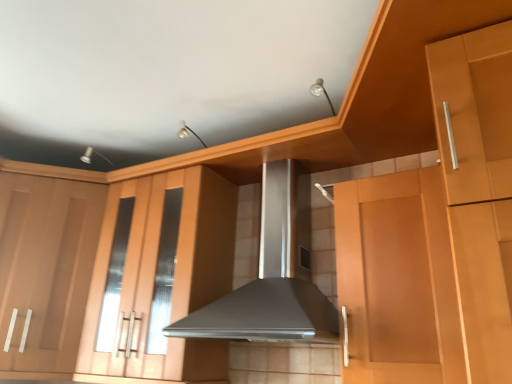
What do you see at coordinates (46, 268) in the screenshot? This screenshot has width=512, height=384. I see `matte wood cabinet at left, arranged as the second cabinetry when viewed from the right` at bounding box center [46, 268].

Describe the element at coordinates (273, 275) in the screenshot. I see `satin silver range hood at center` at that location.

Find the location of a particular element. matte wood cabinet at center, the second cabinetry positioned from the left is located at coordinates (174, 273).

From the image's perspective, is matte wood cabinet at left, positioned as the 1th cabinetry in left-to-right order, over satin silver range hood at center?

No, from the image's perspective, matte wood cabinet at left, positioned as the 1th cabinetry in left-to-right order, is not over satin silver range hood at center.

From a real-world perspective, is matte wood cabinet at left, positioned as the 1th cabinetry in left-to-right order, located beneath satin silver range hood at center?

Yes, from a real-world perspective, matte wood cabinet at left, positioned as the 1th cabinetry in left-to-right order, is beneath satin silver range hood at center.

Considering the sizes of objects matte wood cabinet at left, arranged as the second cabinetry when viewed from the right, and satin silver range hood at center in the image provided, who is wider, matte wood cabinet at left, arranged as the second cabinetry when viewed from the right, or satin silver range hood at center?

With larger width is matte wood cabinet at left, arranged as the second cabinetry when viewed from the right.

Is matte wood cabinet at left, arranged as the second cabinetry when viewed from the right, touching satin silver range hood at center?

No, matte wood cabinet at left, arranged as the second cabinetry when viewed from the right, is not touching satin silver range hood at center.

From the image's perspective, is matte wood cabinet at left, positioned as the 1th cabinetry in left-to-right order, located above or below matte wood cabinet at center, which is the first cabinetry in right-to-left order?

matte wood cabinet at left, positioned as the 1th cabinetry in left-to-right order, is below matte wood cabinet at center, which is the first cabinetry in right-to-left order.

Considering the relative sizes of matte wood cabinet at left, arranged as the second cabinetry when viewed from the right, and matte wood cabinet at center, which is the first cabinetry in right-to-left order, in the image provided, is matte wood cabinet at left, arranged as the second cabinetry when viewed from the right, bigger than matte wood cabinet at center, which is the first cabinetry in right-to-left order,?

Yes, matte wood cabinet at left, arranged as the second cabinetry when viewed from the right, is bigger than matte wood cabinet at center, which is the first cabinetry in right-to-left order.

Does matte wood cabinet at left, arranged as the second cabinetry when viewed from the right, touch matte wood cabinet at center, the second cabinetry positioned from the left?

No, matte wood cabinet at left, arranged as the second cabinetry when viewed from the right, is not in contact with matte wood cabinet at center, the second cabinetry positioned from the left.

From the picture: Considering the positions of objects matte wood cabinet at left, positioned as the 1th cabinetry in left-to-right order, and matte wood cabinet at center, which is the first cabinetry in right-to-left order, in the image provided, who is more to the left, matte wood cabinet at left, positioned as the 1th cabinetry in left-to-right order, or matte wood cabinet at center, which is the first cabinetry in right-to-left order,?

From the viewer's perspective, matte wood cabinet at left, positioned as the 1th cabinetry in left-to-right order, appears more on the left side.

How many degrees apart are the facing directions of satin silver range hood at center and matte wood cabinet at center, the second cabinetry positioned from the left?

They differ by 2.11 degrees in their facing directions.

Image resolution: width=512 pixels, height=384 pixels. What are the coordinates of `home appliance that is in front of the matte wood cabinet at center, which is the first cabinetry in right-to-left order` in the screenshot? It's located at (273, 275).

Which is behind, satin silver range hood at center or matte wood cabinet at center, the second cabinetry positioned from the left?

matte wood cabinet at center, the second cabinetry positioned from the left.

Which is less distant, (302,333) or (228,225)?

Point (302,333) appears to be closer to the viewer than point (228,225).

Is satin silver range hood at center closer to the viewer compared to matte wood cabinet at left, arranged as the second cabinetry when viewed from the right?

Yes, it is.

Is matte wood cabinet at left, positioned as the 1th cabinetry in left-to-right order, completely or partially inside satin silver range hood at center?

No.

How different are the orientations of satin silver range hood at center and matte wood cabinet at left, arranged as the second cabinetry when viewed from the right, in degrees?

They differ by 36.1 degrees in their facing directions.

Considering the relative sizes of satin silver range hood at center and matte wood cabinet at left, positioned as the 1th cabinetry in left-to-right order, in the image provided, is satin silver range hood at center thinner than matte wood cabinet at left, positioned as the 1th cabinetry in left-to-right order,?

Indeed, satin silver range hood at center has a lesser width compared to matte wood cabinet at left, positioned as the 1th cabinetry in left-to-right order.

Is matte wood cabinet at center, the second cabinetry positioned from the left, oriented away from matte wood cabinet at left, arranged as the second cabinetry when viewed from the right?

That's not correct — matte wood cabinet at center, the second cabinetry positioned from the left, is not looking away from matte wood cabinet at left, arranged as the second cabinetry when viewed from the right.

Which object is further away from the camera, matte wood cabinet at center, which is the first cabinetry in right-to-left order, or matte wood cabinet at left, positioned as the 1th cabinetry in left-to-right order?

matte wood cabinet at left, positioned as the 1th cabinetry in left-to-right order, is behind.

From the picture: Could you measure the distance between matte wood cabinet at center, which is the first cabinetry in right-to-left order, and matte wood cabinet at left, arranged as the second cabinetry when viewed from the right?

matte wood cabinet at center, which is the first cabinetry in right-to-left order, is 13.03 inches away from matte wood cabinet at left, arranged as the second cabinetry when viewed from the right.

Can you see matte wood cabinet at center, which is the first cabinetry in right-to-left order, touching satin silver range hood at center?

matte wood cabinet at center, which is the first cabinetry in right-to-left order, and satin silver range hood at center are clearly separated.

Is point (197, 196) behind point (307, 303)?

Yes, point (197, 196) is farther from viewer.

From the image's perspective, is matte wood cabinet at center, the second cabinetry positioned from the left, under satin silver range hood at center?

Yes, from the image's perspective, matte wood cabinet at center, the second cabinetry positioned from the left, is below satin silver range hood at center.

Consider the image. From a real-world perspective, is matte wood cabinet at center, which is the first cabinetry in right-to-left order, positioned above or below satin silver range hood at center?

Clearly, from a real-world perspective, matte wood cabinet at center, which is the first cabinetry in right-to-left order, is below satin silver range hood at center.

At what (x,y) coordinates should I click in order to perform the action: click on home appliance above the matte wood cabinet at left, positioned as the 1th cabinetry in left-to-right order (from a real-world perspective). Please return your answer as a coordinate pair (x, y). Looking at the image, I should click on (273, 275).

Where is `cabinetry to the left of matte wood cabinet at center, the second cabinetry positioned from the left`? The width and height of the screenshot is (512, 384). cabinetry to the left of matte wood cabinet at center, the second cabinetry positioned from the left is located at coordinates (46, 268).

Which object lies further to the anchor point satin silver range hood at center, matte wood cabinet at center, the second cabinetry positioned from the left, or matte wood cabinet at left, positioned as the 1th cabinetry in left-to-right order?

matte wood cabinet at left, positioned as the 1th cabinetry in left-to-right order, is positioned further to the anchor satin silver range hood at center.

Considering their positions, is matte wood cabinet at left, arranged as the second cabinetry when viewed from the right, positioned closer to satin silver range hood at center than matte wood cabinet at center, which is the first cabinetry in right-to-left order?

The object closer to satin silver range hood at center is matte wood cabinet at center, which is the first cabinetry in right-to-left order.

Estimate the real-world distances between objects in this image. Which object is closer to matte wood cabinet at left, positioned as the 1th cabinetry in left-to-right order, satin silver range hood at center or matte wood cabinet at center, the second cabinetry positioned from the left?

The object closer to matte wood cabinet at left, positioned as the 1th cabinetry in left-to-right order, is matte wood cabinet at center, the second cabinetry positioned from the left.

From the image, which object appears to be farther from matte wood cabinet at left, positioned as the 1th cabinetry in left-to-right order, matte wood cabinet at center, the second cabinetry positioned from the left, or satin silver range hood at center?

The object further to matte wood cabinet at left, positioned as the 1th cabinetry in left-to-right order, is satin silver range hood at center.

Estimate the real-world distances between objects in this image. Which object is further from matte wood cabinet at center, which is the first cabinetry in right-to-left order, satin silver range hood at center or matte wood cabinet at left, positioned as the 1th cabinetry in left-to-right order?

satin silver range hood at center is positioned further to the anchor matte wood cabinet at center, which is the first cabinetry in right-to-left order.

From the image, which object appears to be nearer to matte wood cabinet at center, which is the first cabinetry in right-to-left order, matte wood cabinet at left, arranged as the second cabinetry when viewed from the right, or satin silver range hood at center?

Based on the image, matte wood cabinet at left, arranged as the second cabinetry when viewed from the right, appears to be nearer to matte wood cabinet at center, which is the first cabinetry in right-to-left order.

Where is `cabinetry between matte wood cabinet at left, arranged as the second cabinetry when viewed from the right, and satin silver range hood at center from left to right`? This screenshot has width=512, height=384. cabinetry between matte wood cabinet at left, arranged as the second cabinetry when viewed from the right, and satin silver range hood at center from left to right is located at coordinates [174, 273].